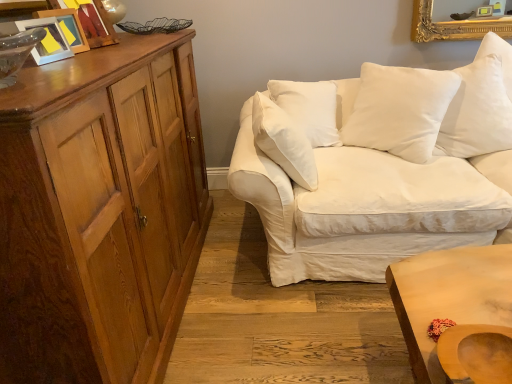
Question: Considering the relative sizes of shiny brown cabinet at left and white cotton couch at right in the image provided, is shiny brown cabinet at left taller than white cotton couch at right?

Choices:
 (A) no
 (B) yes

Answer: (B)

Question: Is shiny brown cabinet at left thinner than white cotton couch at right?

Choices:
 (A) yes
 (B) no

Answer: (A)

Question: From the image's perspective, is shiny brown cabinet at left located beneath white cotton couch at right?

Choices:
 (A) yes
 (B) no

Answer: (A)

Question: Can you confirm if shiny brown cabinet at left is positioned to the left of white cotton couch at right?

Choices:
 (A) yes
 (B) no

Answer: (A)

Question: Can you confirm if shiny brown cabinet at left is smaller than white cotton couch at right?

Choices:
 (A) yes
 (B) no

Answer: (A)

Question: Is shiny brown cabinet at left beside white cotton couch at right?

Choices:
 (A) yes
 (B) no

Answer: (B)

Question: From the image's perspective, is wooden picture frame at upper left, the second picture frame when ordered from front to back, below shiny brown cabinet at left?

Choices:
 (A) yes
 (B) no

Answer: (B)

Question: Does wooden picture frame at upper left, positioned as the second picture frame in back-to-front order, appear on the right side of shiny brown cabinet at left?

Choices:
 (A) no
 (B) yes

Answer: (A)

Question: From a real-world perspective, does wooden picture frame at upper left, the second picture frame when ordered from front to back, sit lower than shiny brown cabinet at left?

Choices:
 (A) no
 (B) yes

Answer: (A)

Question: Is the depth of wooden picture frame at upper left, the second picture frame when ordered from front to back, greater than that of shiny brown cabinet at left?

Choices:
 (A) no
 (B) yes

Answer: (B)

Question: Can you confirm if wooden picture frame at upper left, the second picture frame when ordered from front to back, is taller than shiny brown cabinet at left?

Choices:
 (A) yes
 (B) no

Answer: (B)

Question: Can you confirm if wooden picture frame at upper left, the second picture frame when ordered from front to back, is smaller than shiny brown cabinet at left?

Choices:
 (A) no
 (B) yes

Answer: (B)

Question: Considering the relative sizes of wooden swivel chair at lower right and white cotton pillow at upper right, the 2th pillow viewed from the left, in the image provided, is wooden swivel chair at lower right taller than white cotton pillow at upper right, the 2th pillow viewed from the left,?

Choices:
 (A) yes
 (B) no

Answer: (B)